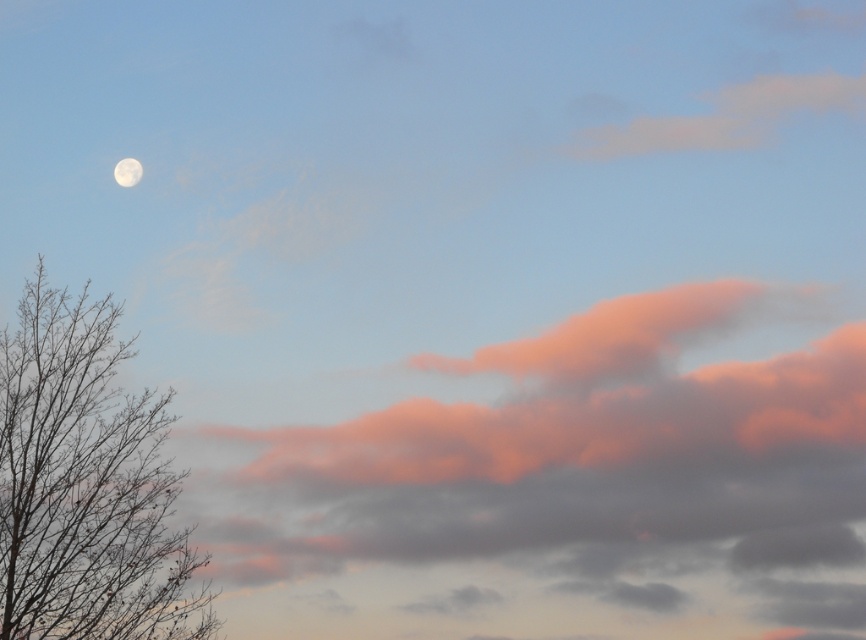
You are an astronomer observing the sky. You notice the bare branches at left and the white fluffy cloud at upper left. Which object is closer to the ground?

The bare branches at left are closer to the ground because they are taller than the white fluffy cloud at upper left, indicating they are positioned lower in the scene.

You are an astronomer observing the sky and notice the bare branches at left and the white fluffy cloud at upper left. Which object would block your view of the moon if they were directly in line?

The bare branches at left would block your view of the moon because it is larger than the white fluffy cloud at upper left.